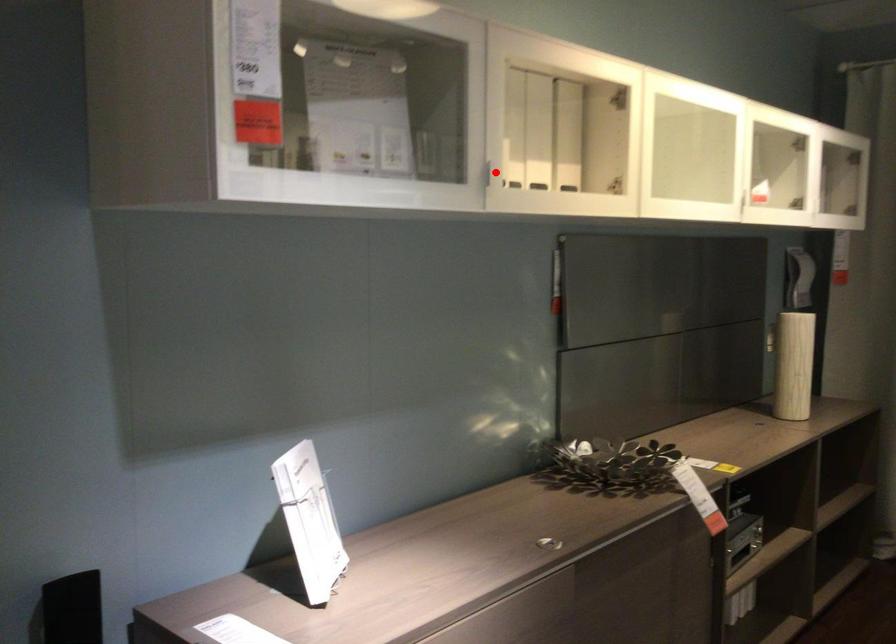
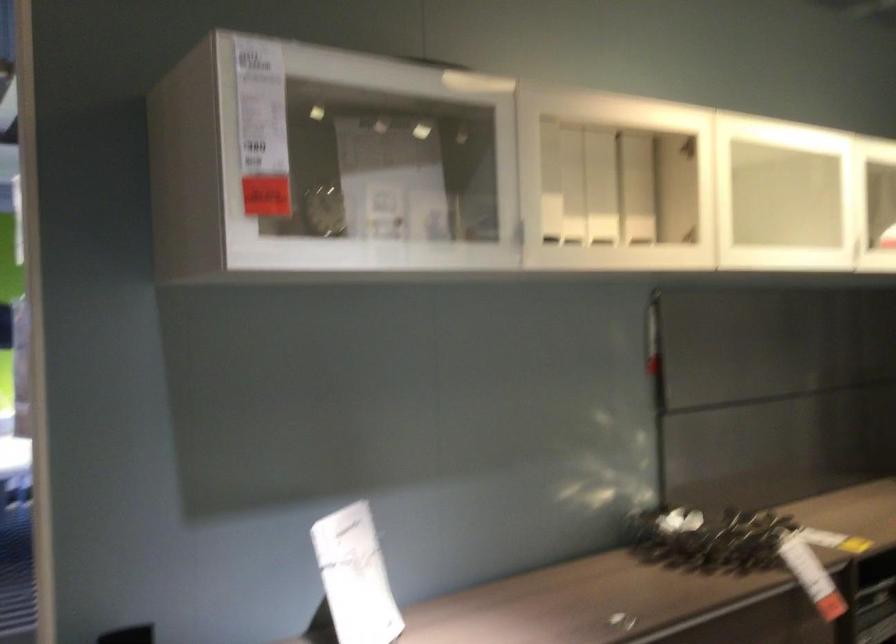
The point at the highlighted location is marked in the first image. Where is the corresponding point in the second image?

(519, 232)